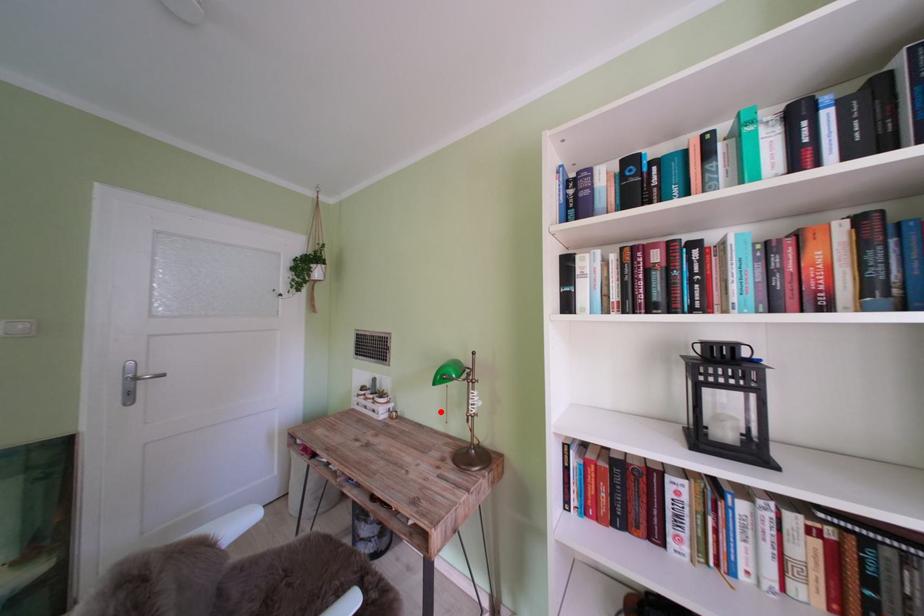
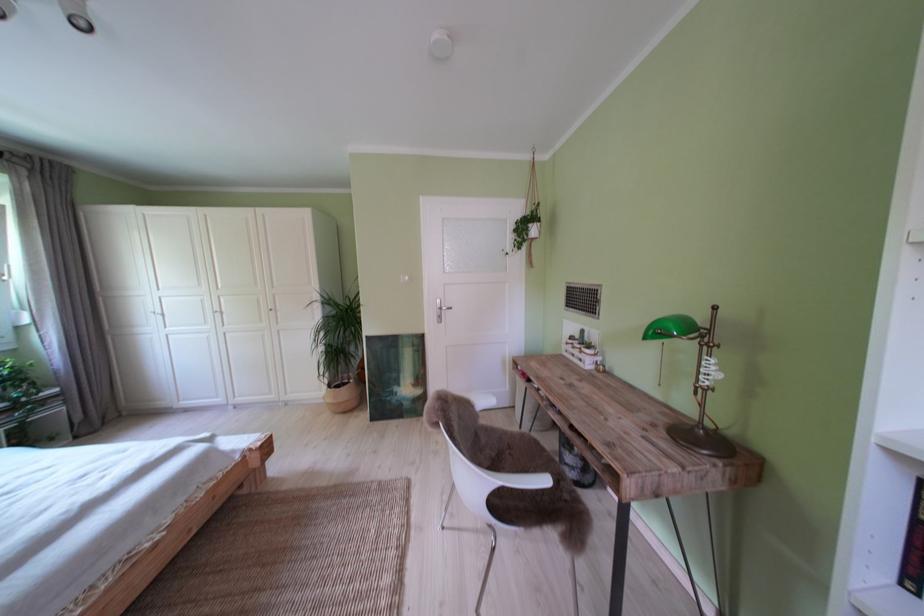
Find the pixel in the second image that matches the highlighted location in the first image.

(652, 371)